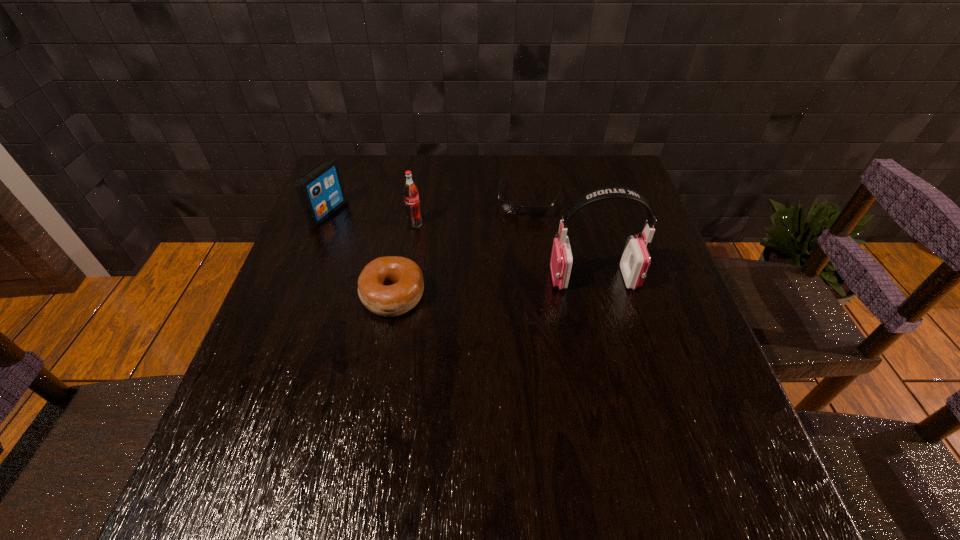
At what (x,y) coordinates should I click in order to perform the action: click on free space on the desktop that is between the bagel and the earphone and is positioned on the label of the soda bottle. Please return your answer as a coordinate pair (x, y). This screenshot has width=960, height=540. Looking at the image, I should click on (517, 285).

Locate an element on the screen. Image resolution: width=960 pixels, height=540 pixels. free spot on the desktop that is between the second shortest object and the tallest object and is positioned on the front screen of the iPod is located at coordinates (522, 285).

The image size is (960, 540). What are the coordinates of `vacant space on the desktop that is between the bagel and the tallest object and is positioned on the front-facing side of the sunglasses` in the screenshot? It's located at (505, 286).